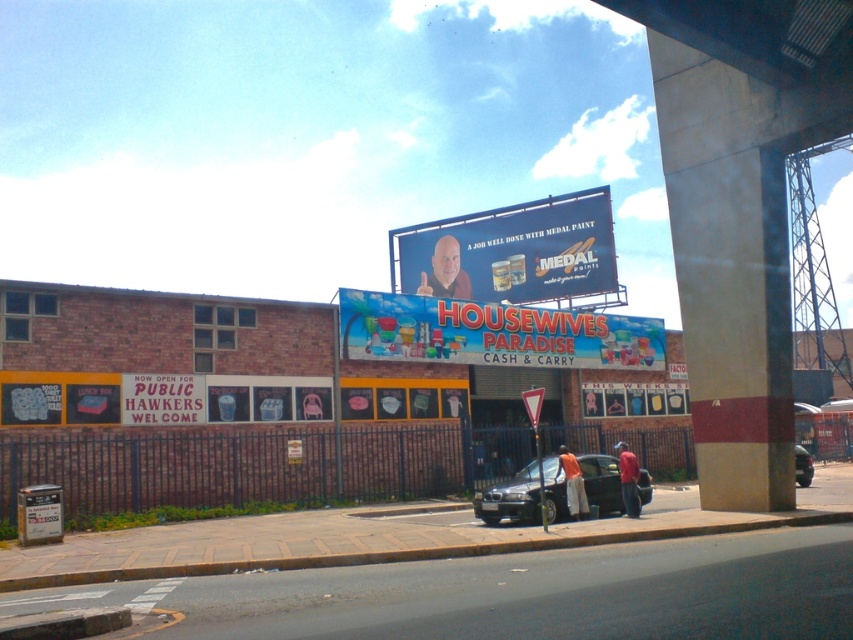
You are a delivery driver who needs to park your metallic gray sedan at lower right near the matte plastic billboard at center. Given that the billboard is larger than the car, can you estimate whether there is enough space between them for your vehicle to maneuver?

The matte plastic billboard at center is larger in size than the metallic gray sedan at lower right, so there should be sufficient space for the vehicle to maneuver around the billboard.

You are a delivery person with a cart that needs to navigate between the blue plastic signboard at center and the black chalkboard sign at lower left. The cart requires a minimum of 10 meters of space to pass safely. Can you safely navigate through the space between them?

The distance between the blue plastic signboard at center and the black chalkboard sign at lower left is 10.74 meters, which is more than the required 10 meters. Therefore, you can safely navigate through the space between them.

You are a delivery person who needs to attach a notice to the taller sign between the blue plastic signboard at center and the black chalkboard sign at lower left. Which sign should you choose?

The blue plastic signboard at center is taller than the black chalkboard sign at lower left, so you should attach the notice to the blue plastic signboard at center.